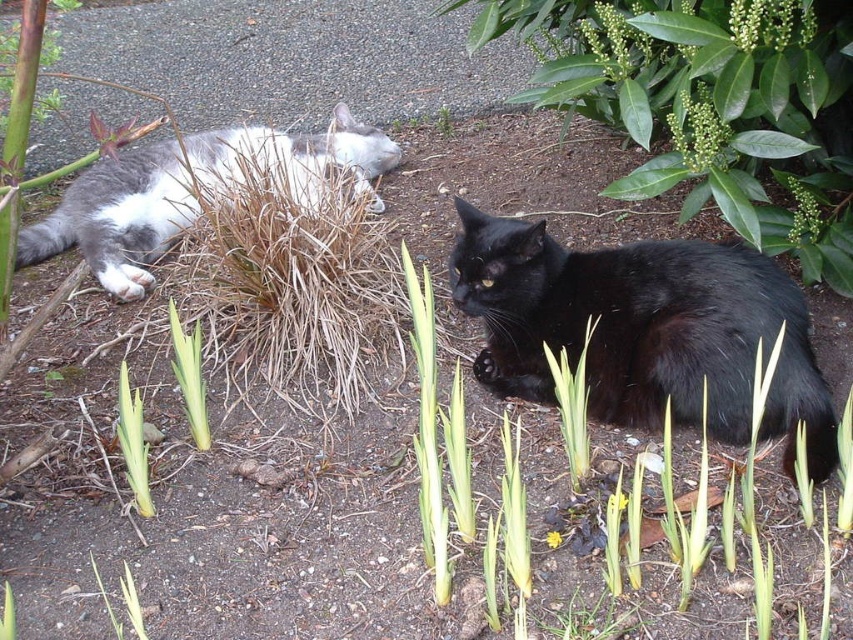
Between black silky cat at center and green leafy plant at lower left, which one appears on the left side from the viewer's perspective?

Positioned to the left is green leafy plant at lower left.

Who is more forward, (x=709, y=268) or (x=120, y=371)?

Positioned in front is point (x=120, y=371).

Between point (601, 291) and point (119, 417), which one is positioned in front?

Point (601, 291) is more forward.

This screenshot has width=853, height=640. What are the coordinates of `black silky cat at center` in the screenshot? It's located at (643, 330).

Describe the element at coordinates (190, 376) in the screenshot. I see `green leafy plant at center` at that location.

Between point (189, 339) and point (136, 456), which one is positioned in front?

Point (136, 456) is more forward.

At what (x,y) coordinates should I click in order to perform the action: click on green leafy plant at center. Please return your answer as a coordinate pair (x, y). Looking at the image, I should click on (190, 376).

Consider the image. Is green leafy bush at upper right to the left of green leafy plant at lower left from the viewer's perspective?

Incorrect, green leafy bush at upper right is not on the left side of green leafy plant at lower left.

Does green leafy bush at upper right have a smaller size compared to green leafy plant at lower left?

No.

Image resolution: width=853 pixels, height=640 pixels. Find the location of `green leafy bush at upper right`. green leafy bush at upper right is located at coordinates (709, 106).